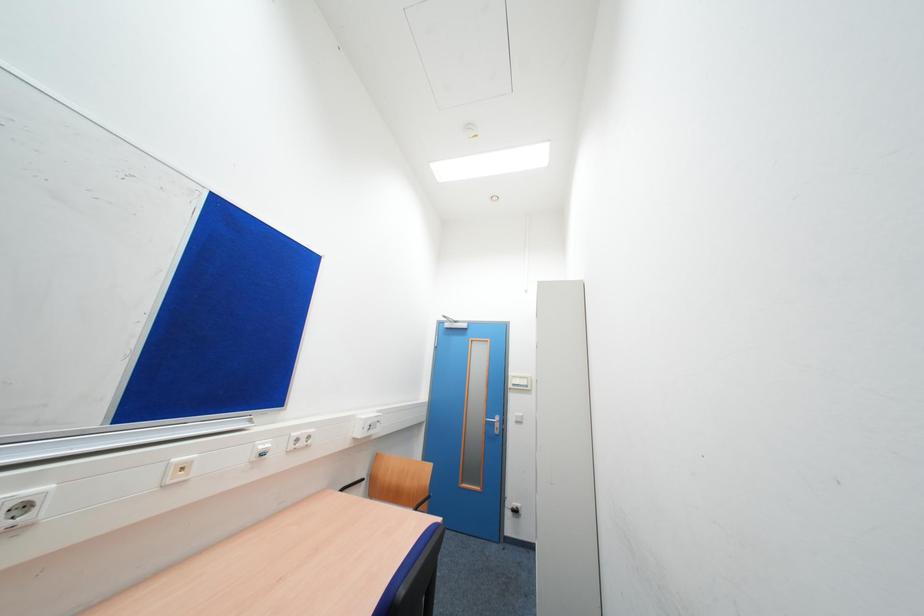
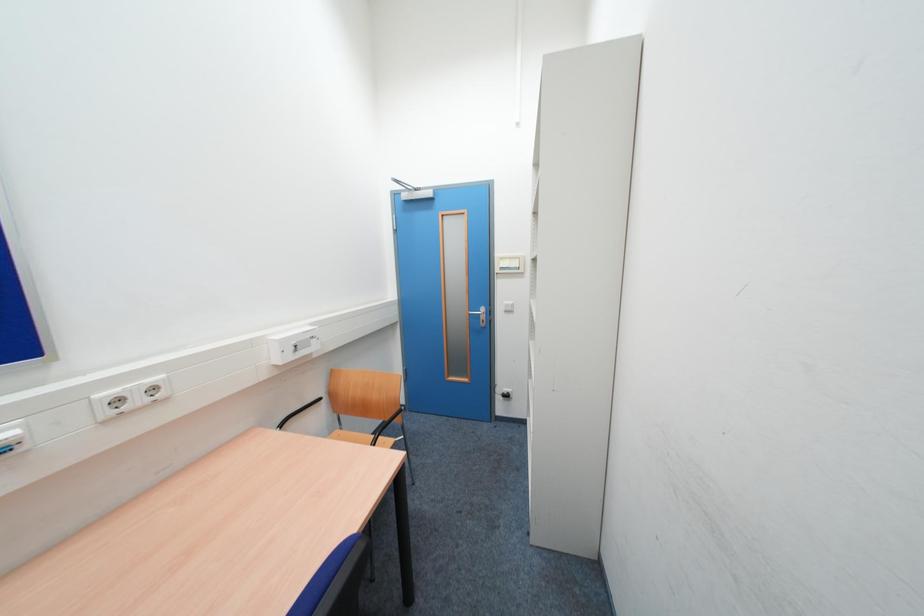
Question: How did the camera likely rotate?

Choices:
 (A) Left
 (B) Right
 (C) Up
 (D) Down

Answer: (D)